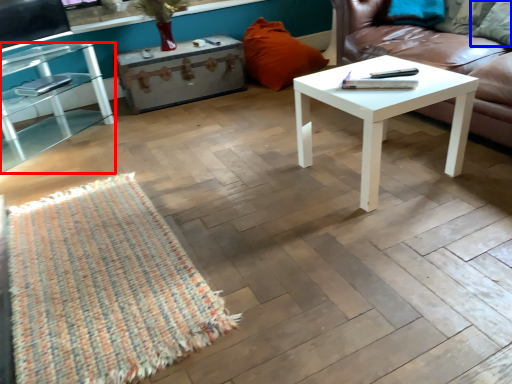
Question: Which of the following is the farthest to the observer, table (highlighted by a red box) or pillow (highlighted by a blue box)?

Choices:
 (A) table
 (B) pillow

Answer: (B)